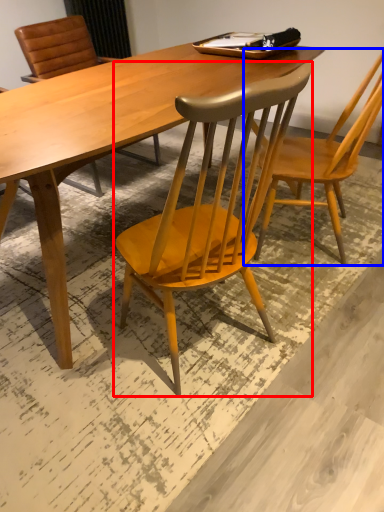
Question: Which of the following is the farthest to the observer, chair (highlighted by a red box) or chair (highlighted by a blue box)?

Choices:
 (A) chair
 (B) chair

Answer: (B)